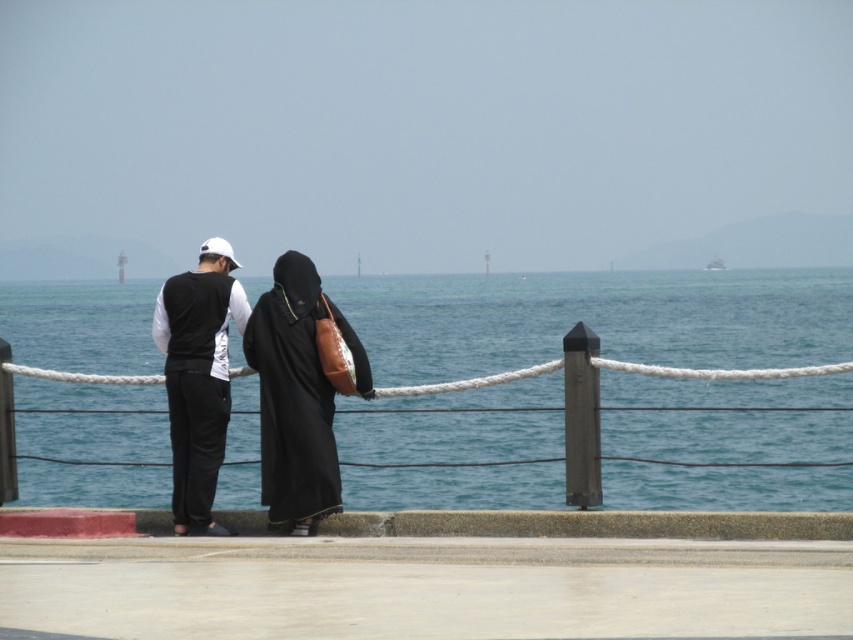
Question: In this image, where is blue water at center located relative to black matte dress at center?

Choices:
 (A) right
 (B) left

Answer: (A)

Question: Estimate the real-world distances between objects in this image. Which object is closer to the blue water at center?

Choices:
 (A) black matte vest at center
 (B) black matte dress at center

Answer: (B)

Question: Is black matte dress at center above black matte vest at center?

Choices:
 (A) no
 (B) yes

Answer: (B)

Question: Which of the following is the farthest from the observer?

Choices:
 (A) (640, 332)
 (B) (206, 353)

Answer: (A)

Question: Is blue water at center positioned behind black matte vest at center?

Choices:
 (A) yes
 (B) no

Answer: (B)

Question: Which object is positioned farthest from the black matte vest at center?

Choices:
 (A) blue water at center
 (B) black matte dress at center

Answer: (A)